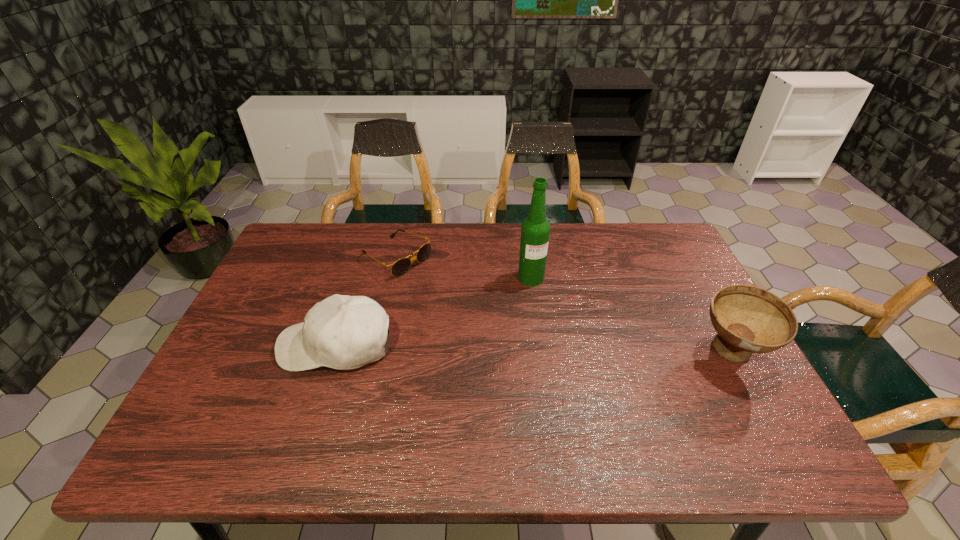
Find the location of `free space between the baseball cap and the soup bowl`. free space between the baseball cap and the soup bowl is located at coordinates (534, 349).

Find the location of a particular element. vacant space that is in between the soup bowl and the sunglasses is located at coordinates (564, 306).

At what (x,y) coordinates should I click in order to perform the action: click on empty space that is in between the rightmost object and the beer bottle. Please return your answer as a coordinate pair (x, y). Looking at the image, I should click on (632, 315).

You are a GUI agent. You are given a task and a screenshot of the screen. Output one action in this format:
    pyautogui.click(x=<x>, y=<y>)
    Task: Click on the third closest object relative to the baseball cap
    The height and width of the screenshot is (540, 960).
    Given the screenshot: What is the action you would take?
    pyautogui.click(x=748, y=319)

Identify which object is the third closest to the soup bowl. Please provide its 2D coordinates. Your answer should be formatted as a tuple, i.e. [(x, y)], where the tuple contains the x and y coordinates of a point satisfying the conditions above.

[(342, 332)]

Find the location of a particular element. The width and height of the screenshot is (960, 540). free space that satisfies the following two spatial constraints: 1. on the front side of the third object from left to right; 2. on the left side of the shortest object is located at coordinates (393, 278).